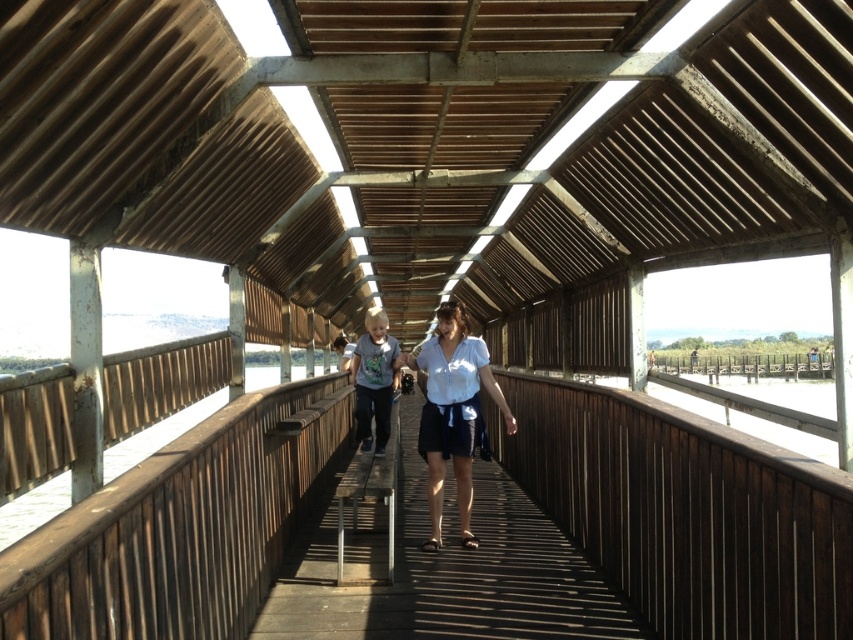
Between point (378, 364) and point (335, 342), which one is positioned behind?

Positioned behind is point (335, 342).

Locate an element on the screen. light gray cotton shirt at center is located at coordinates pyautogui.click(x=373, y=380).

Between point (508, 499) and point (339, 340), which one is positioned behind?

Positioned behind is point (339, 340).

Who is positioned more to the left, wooden bench at center or matte white shirt at center?

Positioned to the left is matte white shirt at center.

This screenshot has width=853, height=640. In order to click on wooden bench at center in this screenshot , I will do `click(444, 570)`.

Who is more forward, (366, 508) or (387, 376)?

Point (387, 376) is in front.

Is point (401, 490) in front of point (396, 346)?

No, (401, 490) is behind (396, 346).

Locate an element on the screen. The height and width of the screenshot is (640, 853). wooden bench at center is located at coordinates (444, 570).

This screenshot has width=853, height=640. What are the coordinates of `wooden bench at center` in the screenshot? It's located at (444, 570).